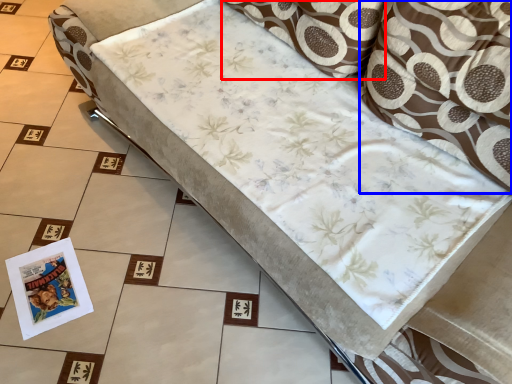
Question: Which of the following is the farthest to the observer, pillow (highlighted by a red box) or throw pillow (highlighted by a blue box)?

Choices:
 (A) pillow
 (B) throw pillow

Answer: (A)